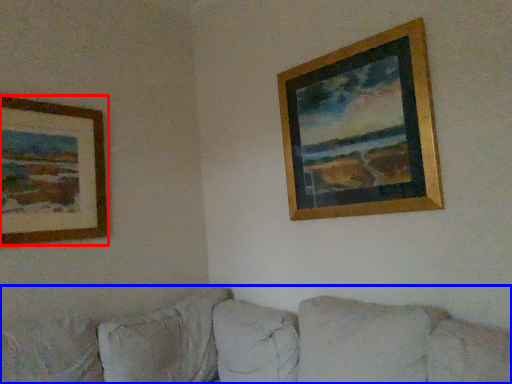
Question: Which point is further to the camera, picture frame (highlighted by a red box) or studio couch (highlighted by a blue box)?

Choices:
 (A) picture frame
 (B) studio couch

Answer: (A)